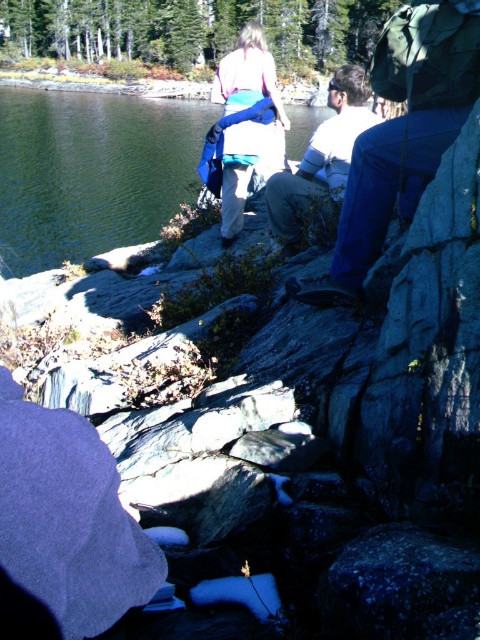
Question: Is matte blue backpack at center positioned at the back of white cotton shirt at center?

Choices:
 (A) yes
 (B) no

Answer: (A)

Question: Among these points, which one is nearest to the camera?

Choices:
 (A) (240, 150)
 (B) (74, 173)

Answer: (A)

Question: Which point is closer to the camera taking this photo?

Choices:
 (A) (238, 156)
 (B) (40, 211)
 (C) (278, 227)

Answer: (C)

Question: Is blue denim jeans at right smaller than matte blue backpack at center?

Choices:
 (A) yes
 (B) no

Answer: (A)

Question: Which object is the farthest from the white cotton shirt at center?

Choices:
 (A) blue denim jeans at right
 (B) green liquid water at left

Answer: (B)

Question: Can you confirm if green liquid water at left is thinner than white cotton shirt at center?

Choices:
 (A) no
 (B) yes

Answer: (A)